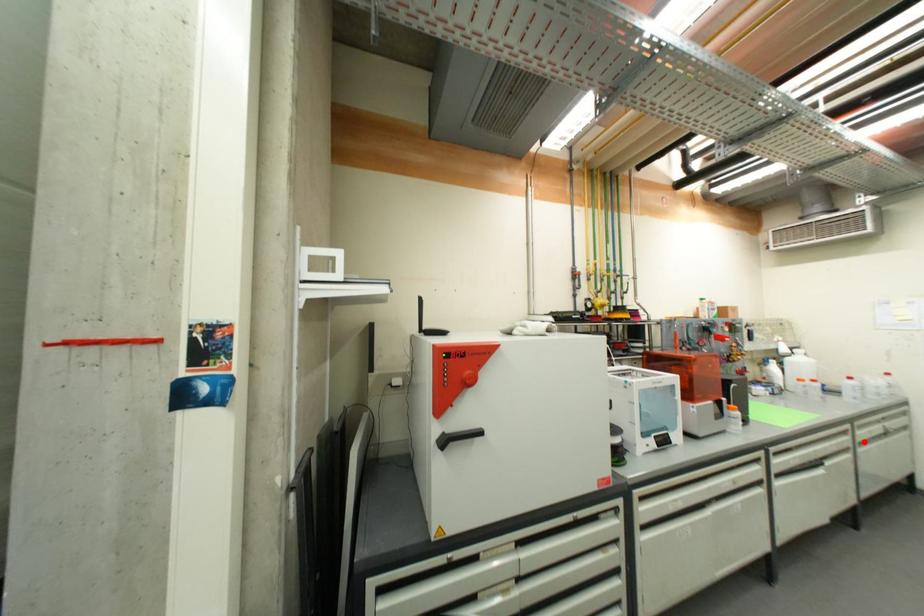
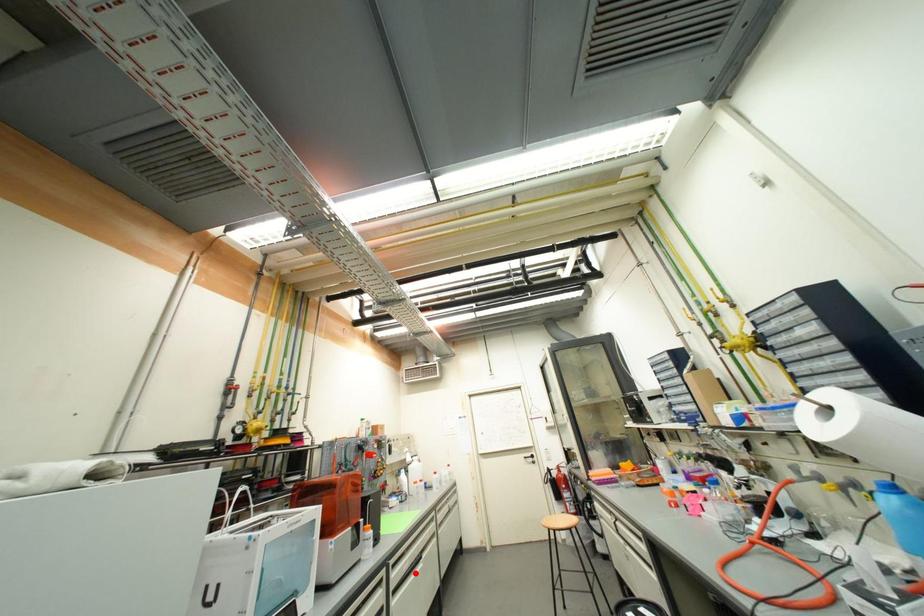
I am providing you with two images of the same scene from different viewpoints. A red point is marked on the first image and another point is marked on the second image. Is the red point in image1 aligned with the point shown in image2?

No